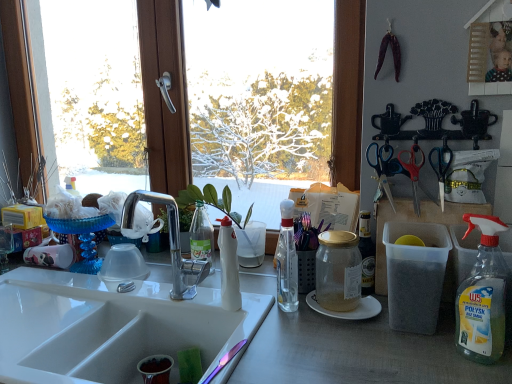
Locate an element on the screen. unoccupied area in front of white matte bottle at center, which appears as the first bottle when viewed from the left is located at coordinates (258, 337).